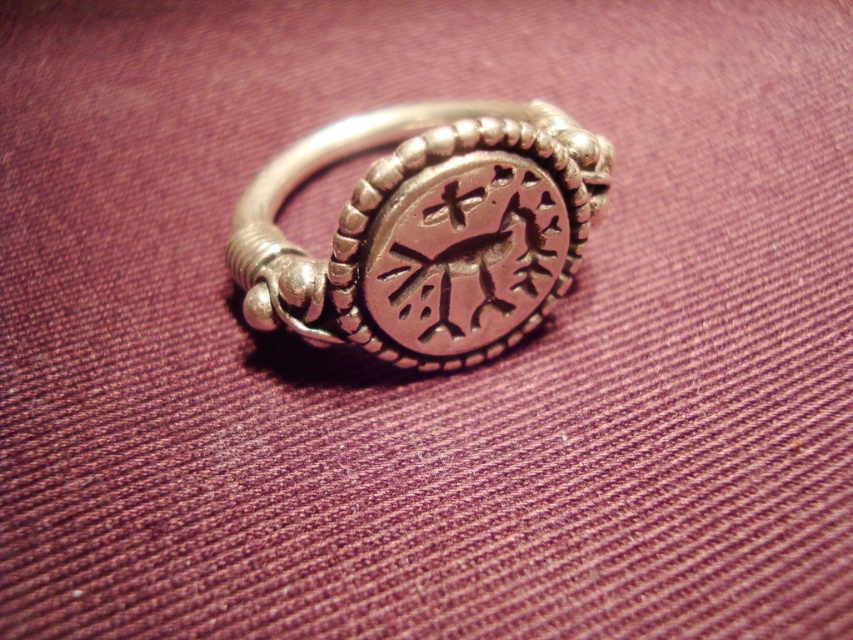
Question: Is polished silver ring at center thinner than dark brown textured stone at center?

Choices:
 (A) no
 (B) yes

Answer: (A)

Question: Which of the following is the farthest from the observer?

Choices:
 (A) (445, 250)
 (B) (409, 145)

Answer: (A)

Question: Can you confirm if polished silver ring at center is positioned below dark brown textured stone at center?

Choices:
 (A) no
 (B) yes

Answer: (A)

Question: Can you confirm if polished silver ring at center is positioned below dark brown textured stone at center?

Choices:
 (A) yes
 (B) no

Answer: (B)

Question: Which object is closer to the camera taking this photo?

Choices:
 (A) polished silver ring at center
 (B) dark brown textured stone at center

Answer: (A)